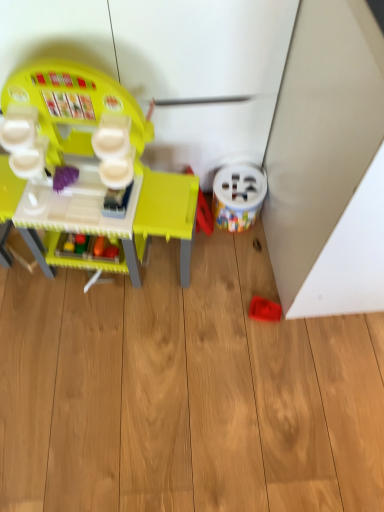
Find the location of a particular element. free area in between matte plastic play kitchen at left, positioned as the third toy in right-to-left order, and rubberized red toy at lower right, which appears as the 1th toy when viewed from the right is located at coordinates (210, 286).